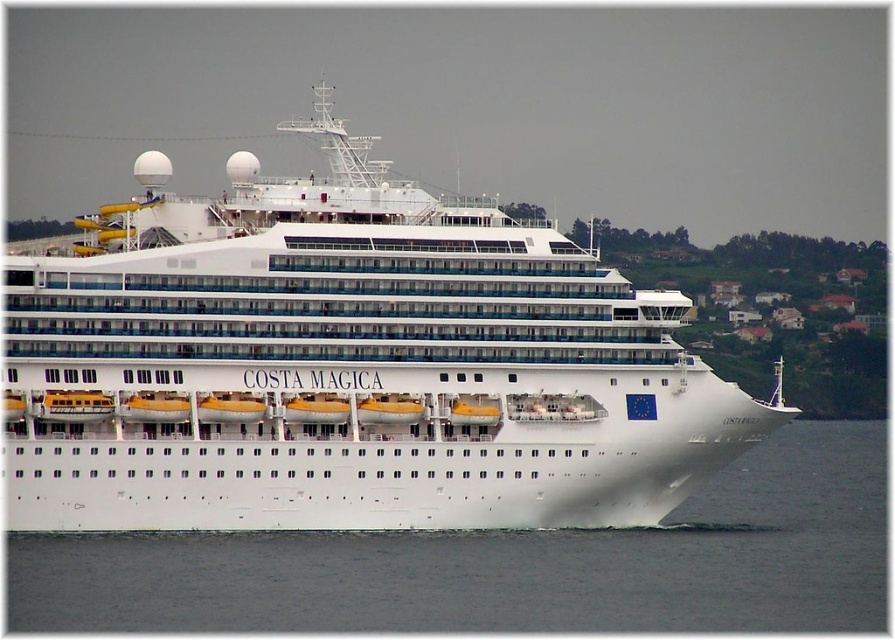
Question: Is white glossy cruise ship at center closer to the viewer compared to white water at lower center?

Choices:
 (A) no
 (B) yes

Answer: (A)

Question: Which object is farther from the camera taking this photo?

Choices:
 (A) white water at lower center
 (B) white glossy cruise ship at center

Answer: (B)

Question: Does white glossy cruise ship at center have a larger size compared to white water at lower center?

Choices:
 (A) yes
 (B) no

Answer: (A)

Question: Among these objects, which one is nearest to the camera?

Choices:
 (A) white water at lower center
 (B) white glossy cruise ship at center

Answer: (A)

Question: Is white glossy cruise ship at center further to camera compared to white water at lower center?

Choices:
 (A) yes
 (B) no

Answer: (A)